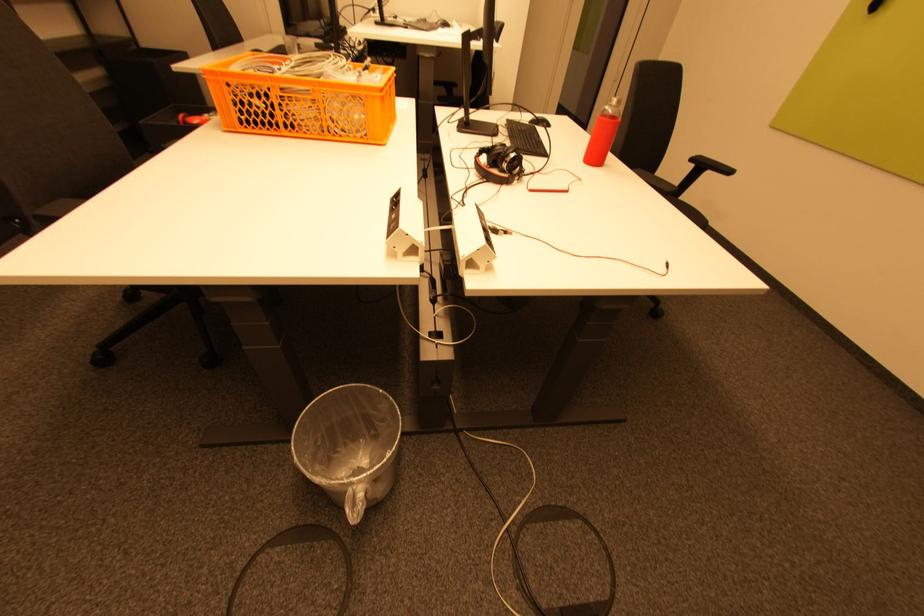
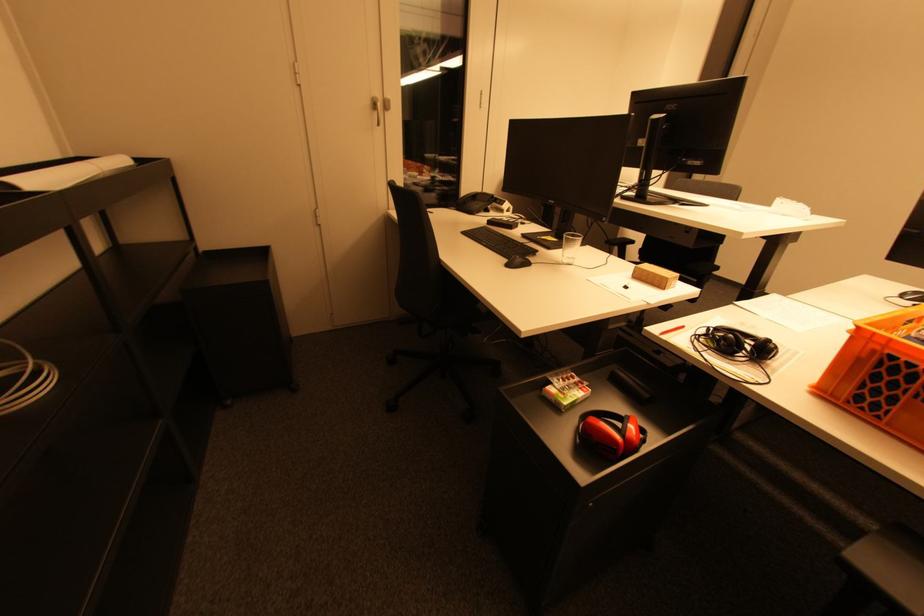
The images are taken continuously from a first-person perspective. In which direction are you moving?

The movement direction of the cameraman is left, forward.